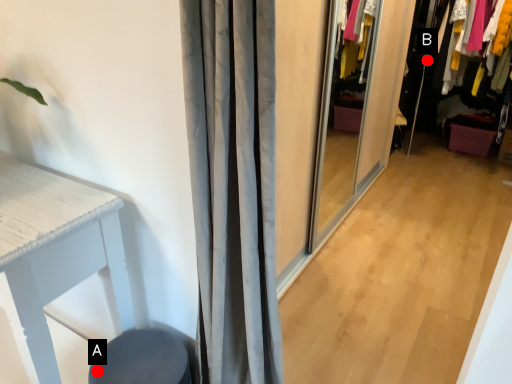
Question: Two points are circled on the image, labeled by A and B beside each circle. Which point is closer to the camera?

Choices:
 (A) A is closer
 (B) B is closer

Answer: (A)